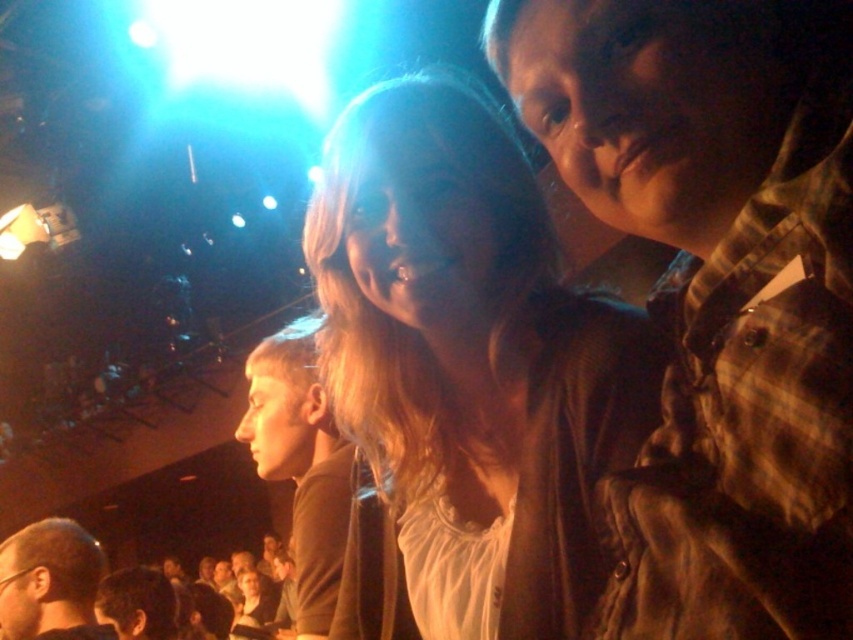
Between point (596, 148) and point (364, 337), which one is positioned behind?

Point (364, 337)

Is brown plaid shirt at upper right below light brown hair at center?

Actually, brown plaid shirt at upper right is above light brown hair at center.

Measure the distance between point (717, 240) and camera.

Point (717, 240) is 63.08 centimeters from camera.

Where is `brown plaid shirt at upper right`? brown plaid shirt at upper right is located at coordinates (717, 291).

Is light brown hair at center thinner than brown matte shirt at center?

In fact, light brown hair at center might be wider than brown matte shirt at center.

Is light brown hair at center above brown matte shirt at center?

Yes, light brown hair at center is above brown matte shirt at center.

Locate an element on the screen. light brown hair at center is located at coordinates (471, 362).

Between light brown hair at center and light brown hair at lower left, which one has more height?

light brown hair at center is taller.

Does light brown hair at center have a greater width compared to light brown hair at lower left?

Correct, the width of light brown hair at center exceeds that of light brown hair at lower left.

Who is more distant from viewer, (599,330) or (32,584)?

Positioned behind is point (32,584).

At what (x,y) coordinates should I click in order to perform the action: click on light brown hair at center. Please return your answer as a coordinate pair (x, y). This screenshot has width=853, height=640. Looking at the image, I should click on (471, 362).